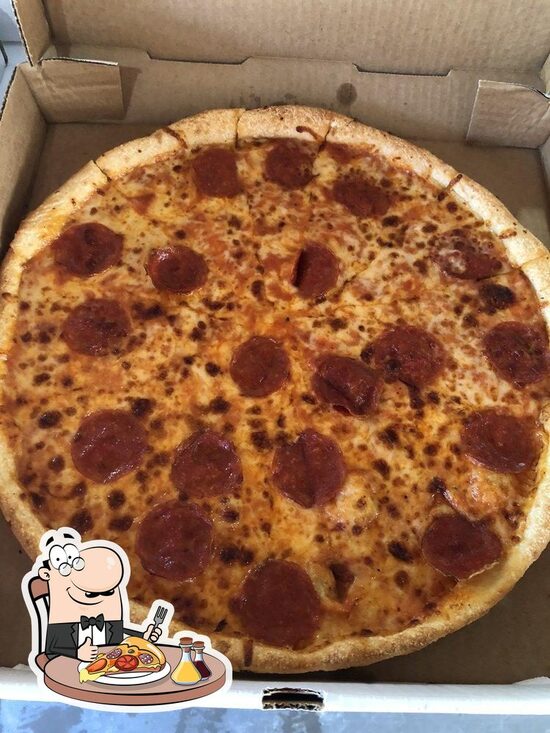
Where is `table`? table is located at coordinates (151, 688).